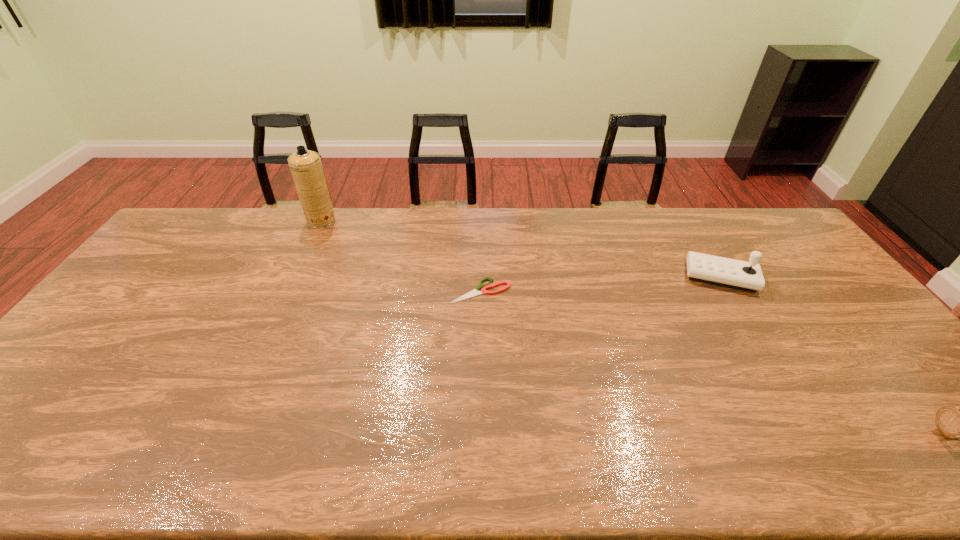
Identify the location of the closest object to the aerosol can. The height and width of the screenshot is (540, 960). (490, 285).

Find the location of a particular element. vacant space that satisfies the following two spatial constraints: 1. on the back side of the joystick; 2. on the right side of the scissors is located at coordinates (480, 276).

This screenshot has width=960, height=540. I want to click on vacant space that satisfies the following two spatial constraints: 1. on the front side of the shortest object; 2. on the right side of the aerosol can, so click(288, 291).